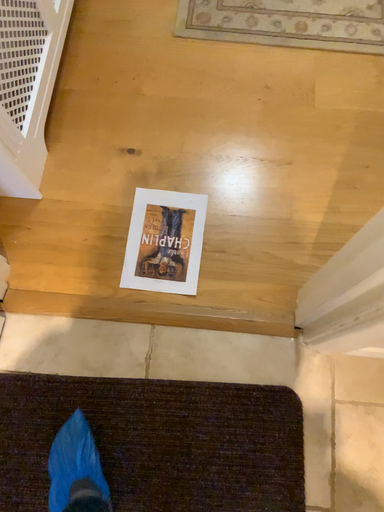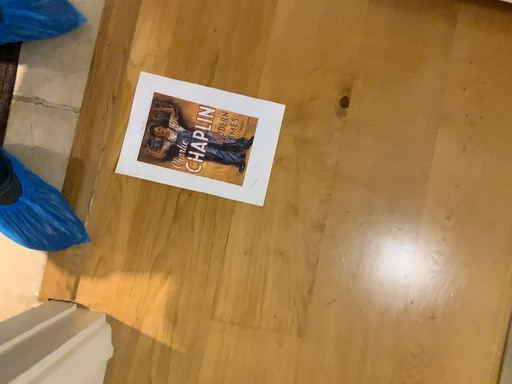
Question: Which way did the camera rotate in the video?

Choices:
 (A) rotated right
 (B) rotated left

Answer: (B)